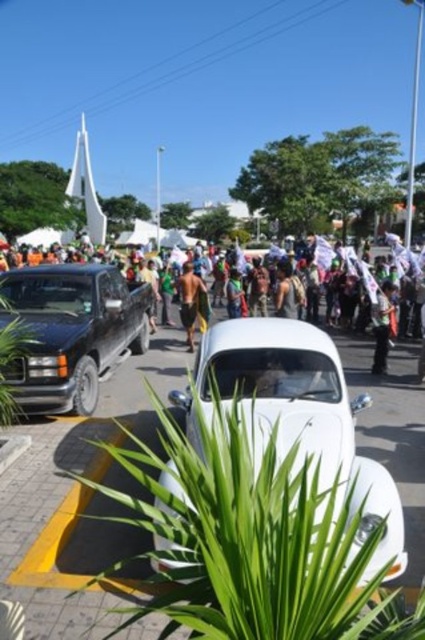
You are standing at the point with coordinates point (71, 332). What object are you standing on?

You are standing on the shiny black truck at center.

You are a photographer trying to capture a photo of the shiny black truck at center and the dark gray fabric shirt at center from the left side of the road. Which object should you place on the left side of your photo frame to ensure both are visible?

You should place the shiny black truck at center on the left side of your photo frame because it is already positioned to the left of the dark gray fabric shirt at center in the scene.

You are standing at the point with coordinates point (71,332) in the image. What object are you standing on?

You are standing on the shiny black truck at center.